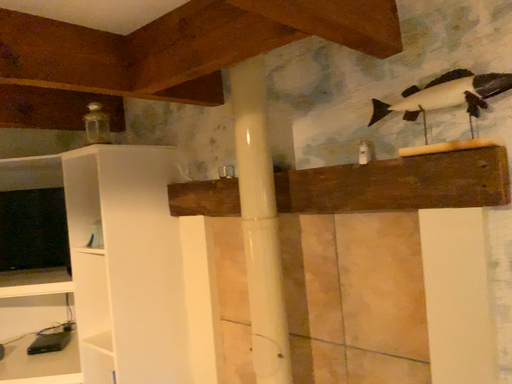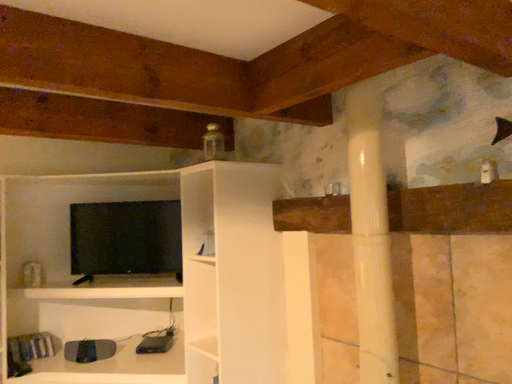
Question: How did the camera likely rotate when shooting the video?

Choices:
 (A) rotated left
 (B) rotated right

Answer: (A)